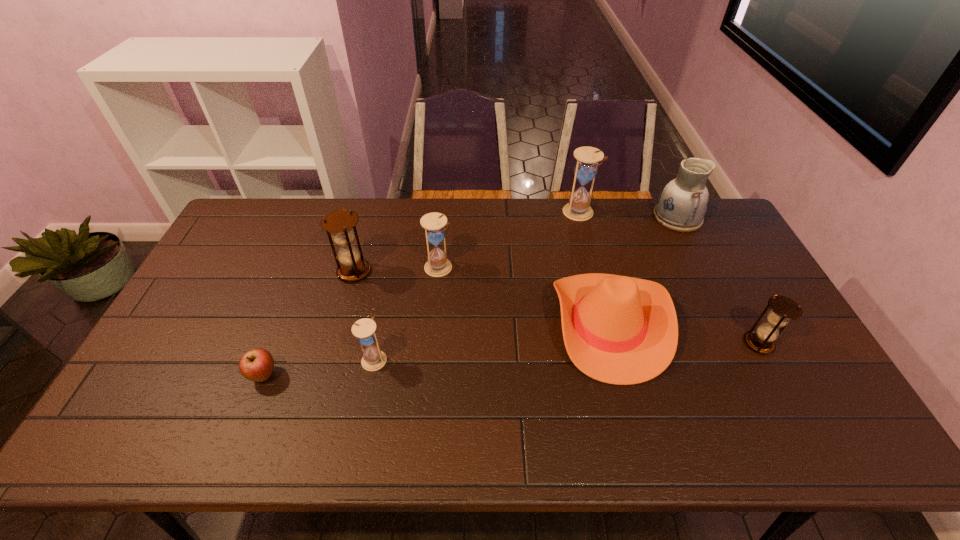
Where is `the fourth hourglass from left to right`? The width and height of the screenshot is (960, 540). the fourth hourglass from left to right is located at coordinates (585, 170).

In order to click on the farthest white hourglass in this screenshot , I will do `click(585, 170)`.

You are a GUI agent. You are given a task and a screenshot of the screen. Output one action in this format:
    pyautogui.click(x=<x>, y=<y>)
    Task: Click on the blue pottery
    Image resolution: width=960 pixels, height=540 pixels.
    Given the screenshot: What is the action you would take?
    pyautogui.click(x=681, y=206)

The height and width of the screenshot is (540, 960). Find the location of `the second object from left to right`. the second object from left to right is located at coordinates (352, 267).

At what (x,y) coordinates should I click in order to perform the action: click on the bigger brown hourglass. Please return your answer as a coordinate pair (x, y). Looking at the image, I should click on (352, 267).

Where is `the third hourglass from left to right`? This screenshot has height=540, width=960. the third hourglass from left to right is located at coordinates (437, 265).

In order to click on the fourth object from left to right in this screenshot , I will do `click(437, 265)`.

Locate an element on the screen. cowboy hat is located at coordinates (621, 330).

The height and width of the screenshot is (540, 960). Find the location of `the smaller brown hourglass`. the smaller brown hourglass is located at coordinates (783, 309).

The image size is (960, 540). What are the coordinates of `the nearer brown hourglass` in the screenshot? It's located at coord(783,309).